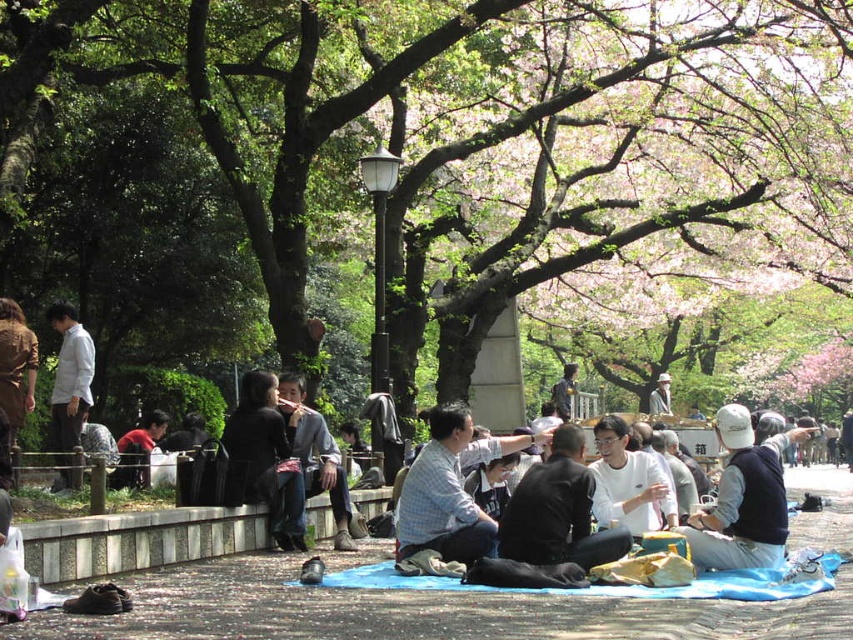
Can you confirm if black leather jacket at center is shorter than light brown fabric hat at center?

No.

Image resolution: width=853 pixels, height=640 pixels. What do you see at coordinates (264, 458) in the screenshot? I see `black leather jacket at center` at bounding box center [264, 458].

Find the location of a particular element. The image size is (853, 640). black leather jacket at center is located at coordinates (264, 458).

Who is shorter, green leafy tree at center or white cap at center?

white cap at center

Does point (224, 88) come behind point (785, 445)?

Yes, it is.

Is point (619, 49) farther from viewer compared to point (735, 476)?

Yes, it is behind point (735, 476).

Identify the location of green leafy tree at center. (410, 161).

Who is more distant from viewer, (561, 401) or (668, 408)?

Point (668, 408)

Does dark gray sweater at center have a greater height compared to light brown fabric hat at center?

No, dark gray sweater at center is not taller than light brown fabric hat at center.

Which is behind, point (567, 387) or point (665, 380)?

Positioned behind is point (665, 380).

Image resolution: width=853 pixels, height=640 pixels. Find the location of `dark gray sweater at center`. dark gray sweater at center is located at coordinates (564, 392).